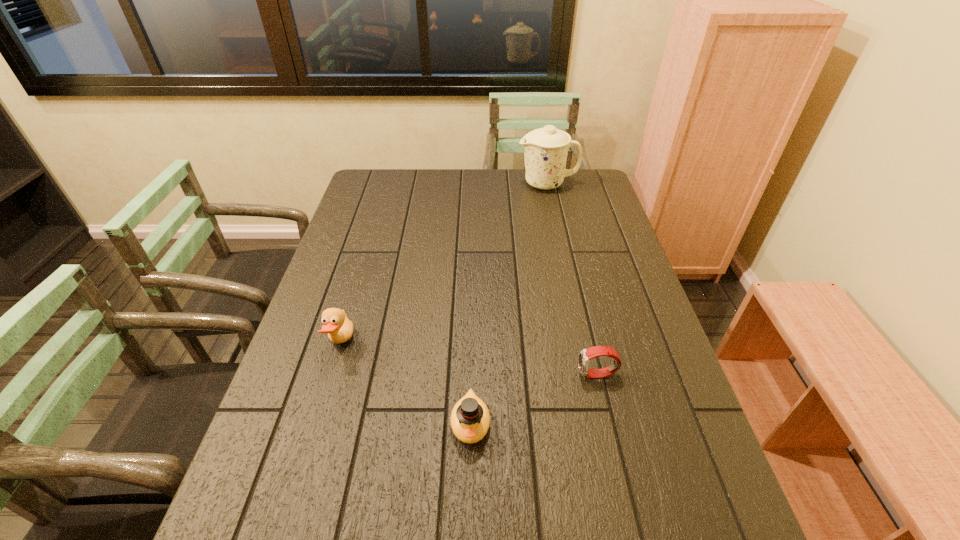
In the image, there is a desktop. In order to click on vacant space at the far edge in this screenshot , I will do `click(524, 173)`.

Image resolution: width=960 pixels, height=540 pixels. I want to click on vacant space at the left edge of the desktop, so click(x=371, y=214).

You are a GUI agent. You are given a task and a screenshot of the screen. Output one action in this format:
    pyautogui.click(x=<x>, y=<y>)
    Task: Click on the vacant space at the right edge of the desktop
    This screenshot has width=960, height=540.
    Given the screenshot: What is the action you would take?
    pyautogui.click(x=647, y=329)

Find the location of a particular element. free location at the far right corner is located at coordinates (580, 183).

The width and height of the screenshot is (960, 540). In order to click on empty location between the nearest object and the chinaware in this screenshot , I will do `click(509, 304)`.

Identify the location of free spot between the watch and the tallest object. (572, 280).

This screenshot has height=540, width=960. I want to click on free area in between the watch and the chinaware, so click(x=572, y=280).

Locate an element on the screen. vacant area that lies between the shortest object and the second object from left to right is located at coordinates (534, 399).

Locate an element on the screen. free space between the shortest object and the third object from right to left is located at coordinates (534, 399).

Where is `vacant region between the second tallest object and the third object from right to left`? The width and height of the screenshot is (960, 540). vacant region between the second tallest object and the third object from right to left is located at coordinates (406, 383).